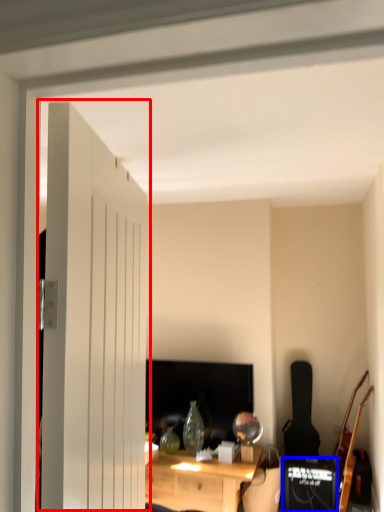
Question: Which object appears closest to the camera in this image, door (highlighted by a red box) or speaker (highlighted by a blue box)?

Choices:
 (A) door
 (B) speaker

Answer: (A)